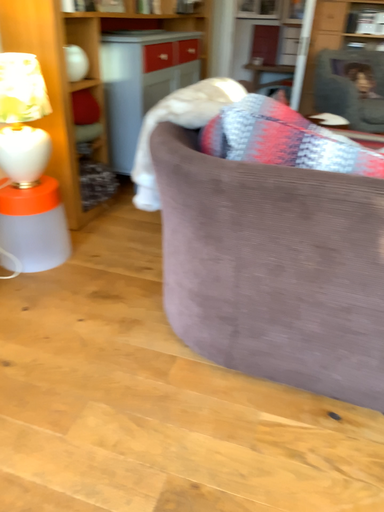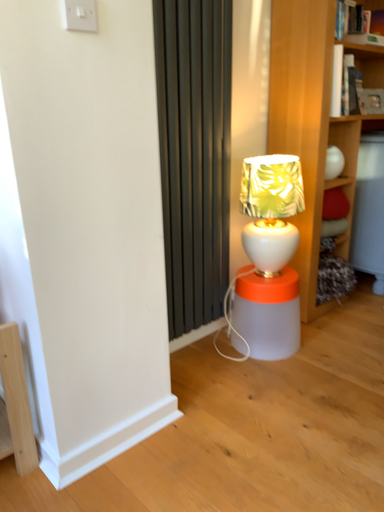
Question: Which way did the camera rotate in the video?

Choices:
 (A) rotated right
 (B) rotated left

Answer: (B)